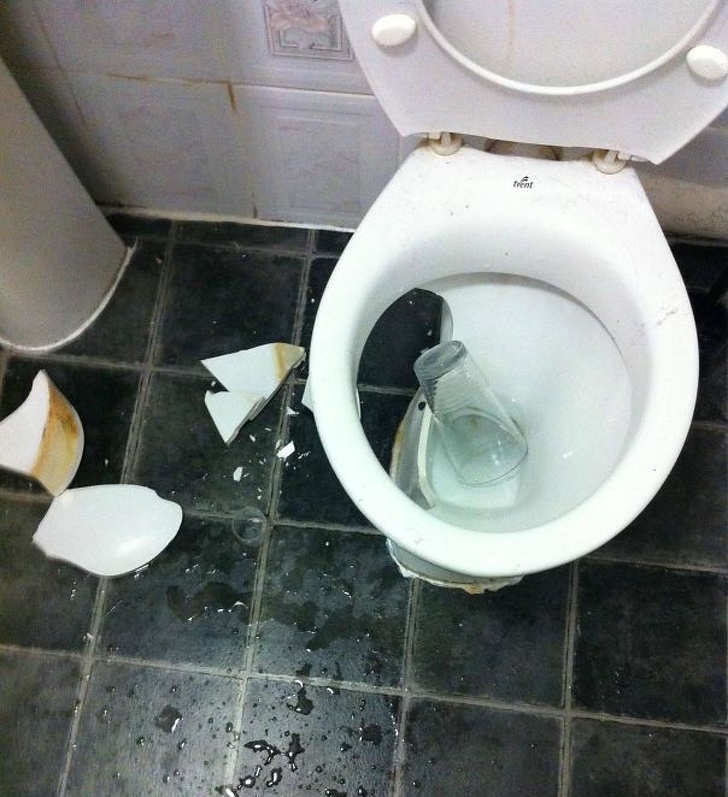
Find the location of a particular element. This screenshot has height=797, width=728. glass cup is located at coordinates (474, 418).